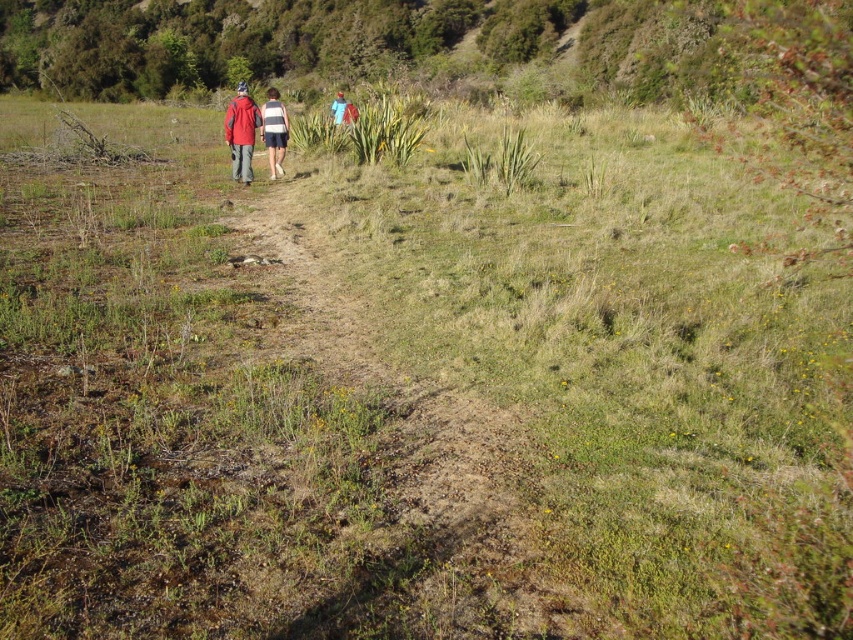
Question: Does green grassy hillside at upper center have a greater width compared to red fabric jacket at center?

Choices:
 (A) no
 (B) yes

Answer: (B)

Question: Which point appears farthest from the camera in this image?

Choices:
 (A) (280, 108)
 (B) (283, 125)

Answer: (B)

Question: Where is dried grass at center located in relation to red fabric jacket at center in the image?

Choices:
 (A) right
 (B) left

Answer: (A)

Question: Which object appears farthest from the camera in this image?

Choices:
 (A) red fabric jacket at center
 (B) striped fabric shorts at center
 (C) dried grass at center

Answer: (B)

Question: Which object is the closest to the red fabric jacket at center?

Choices:
 (A) striped fabric shorts at center
 (B) dried grass at center

Answer: (A)

Question: Where is red fabric jacket at center located in relation to striped fabric shorts at center in the image?

Choices:
 (A) above
 (B) below

Answer: (B)